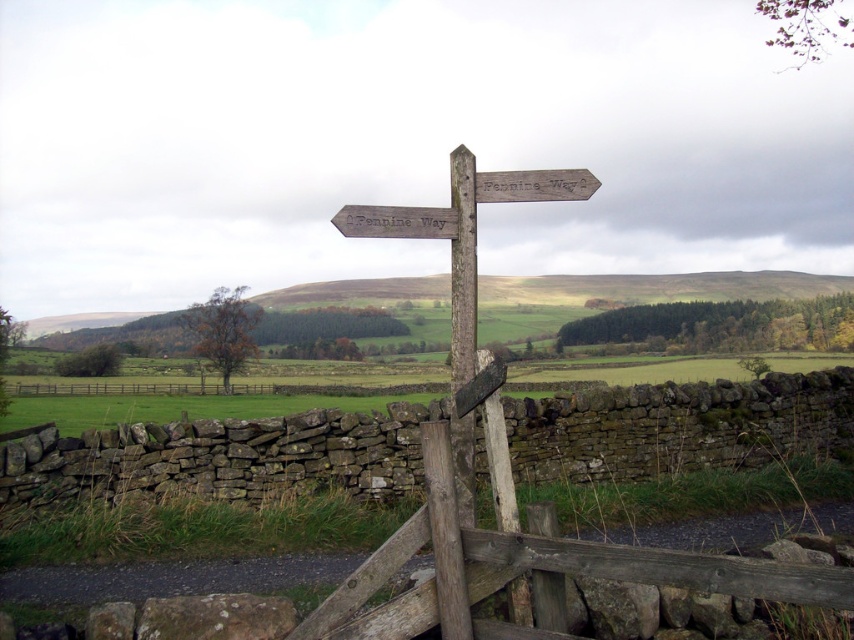
You are a hiker trying to read the weathered wood signpost at center. Can you see the brown wooden fence at lower left behind the signpost?

The weathered wood signpost at center is positioned over brown wooden fence at lower left, so yes, the brown wooden fence at lower left is visible behind the signpost.

You are a hiker trying to read the weathered wood signpost at center. There is a brown wooden fence at lower left nearby. Could the fence block your view of the signpost?

The weathered wood signpost at center is taller than the brown wooden fence at lower left, so the fence is not tall enough to block your view of the signpost.

You are a hiker trying to determine your position relative to the weathered wood signpost at center. According to the coordinates provided, where exactly is the signpost positioned in the image?

The weathered wood signpost at center is located at point coordinates of (463, 268).